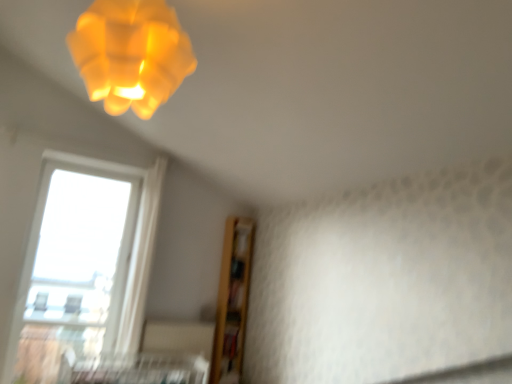
Question: Considering the relative positions of matte yellow plastic lamp at upper left and metallic silver bed frame at lower center in the image provided, is matte yellow plastic lamp at upper left to the left or to the right of metallic silver bed frame at lower center?

Choices:
 (A) left
 (B) right

Answer: (B)

Question: Choose the correct answer: Is matte yellow plastic lamp at upper left inside metallic silver bed frame at lower center or outside it?

Choices:
 (A) inside
 (B) outside

Answer: (B)

Question: Which object is positioned farthest from the matte yellow plastic lamp at upper left?

Choices:
 (A) transparent glass window at lower left
 (B) metallic silver bed frame at lower center

Answer: (B)

Question: Which is farther from the matte yellow plastic lamp at upper left?

Choices:
 (A) transparent glass window at lower left
 (B) metallic silver bed frame at lower center

Answer: (B)